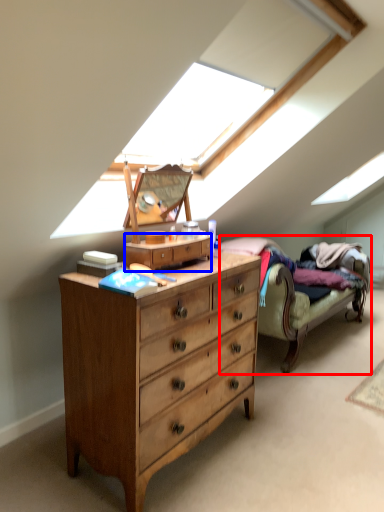
Question: Which point is closer to the camera, studio couch (highlighted by a red box) or file cabinet (highlighted by a blue box)?

Choices:
 (A) studio couch
 (B) file cabinet

Answer: (B)